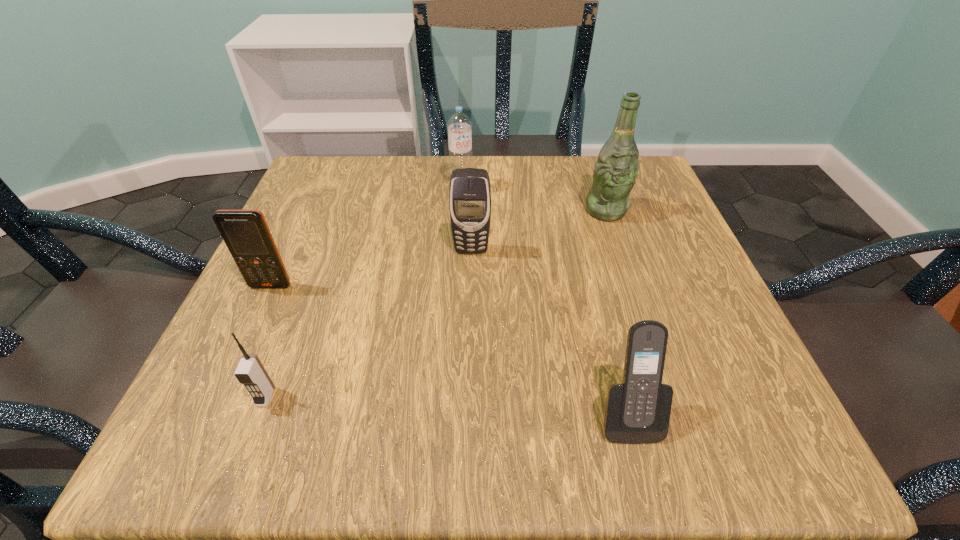
Locate an element on the screen. The width and height of the screenshot is (960, 540). the tallest object is located at coordinates (615, 172).

Where is `beer bottle`? beer bottle is located at coordinates (615, 172).

The height and width of the screenshot is (540, 960). I want to click on the farthest object, so click(x=459, y=125).

Locate an element on the screen. The width and height of the screenshot is (960, 540). the farthest cellular telephone is located at coordinates (469, 195).

The image size is (960, 540). I want to click on the third cellular telephone from left to right, so click(469, 195).

The image size is (960, 540). I want to click on the leftmost object, so click(x=246, y=234).

In order to click on the second farthest cellular telephone in this screenshot , I will do `click(246, 234)`.

This screenshot has height=540, width=960. I want to click on the rightmost cellular telephone, so click(x=637, y=411).

The width and height of the screenshot is (960, 540). Identify the location of the second object from left to right. (250, 372).

This screenshot has height=540, width=960. What are the coordinates of `the shortest cellular telephone` in the screenshot? It's located at (250, 372).